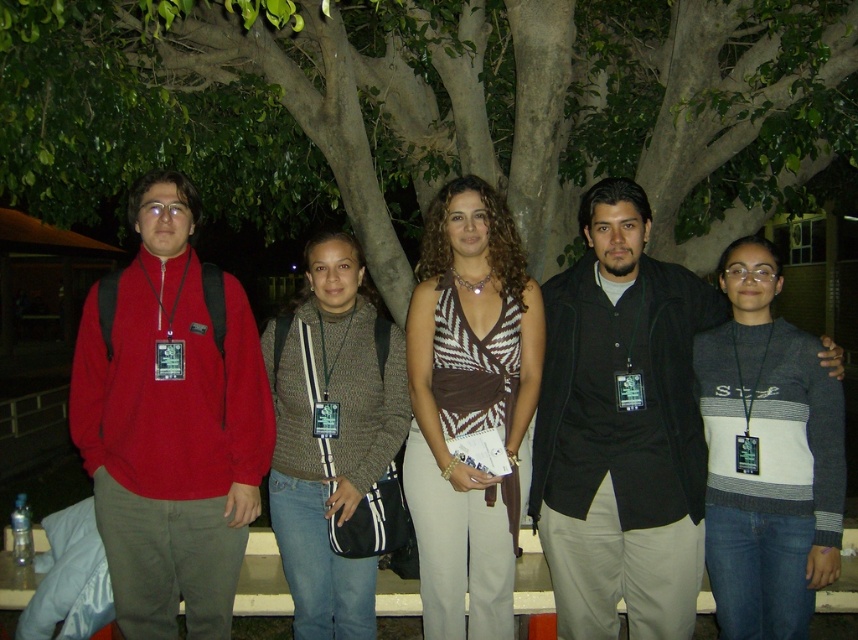
You are a photographer trying to capture a clear shot of both the brown textured top at center and the gray sweater at center. Which one should you focus on first to ensure it appears sharp in the photo?

You should focus on the brown textured top at center first because it is closer to you than the gray sweater at center, ensuring it will be sharp in the photo.

You are a photographer trying to capture a group photo of the five people. The two people wearing the brown textured top at center and the knit sweater at center are standing too close to each other. How much space is there between them?

The distance between the brown textured top at center and the knit sweater at center is 35.55 centimeters.

You are a photographer trying to capture the group in the image. You want to ensure both the brown textured top at center and the knit sweater at center are clearly visible in your shot. Given their sizes, which one might you need to adjust your focus on to ensure it stands out more?

The brown textured top at center is bigger than the knit sweater at center, so you should focus on the brown textured top at center to ensure it stands out more in the photo.